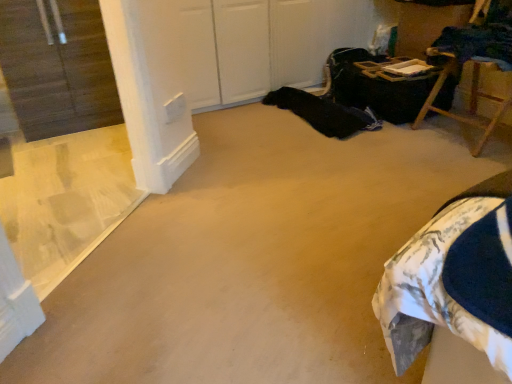
This screenshot has height=384, width=512. I want to click on vacant space that is in between wooden folding chair at upper right and transparent plastic window at left, so click(332, 180).